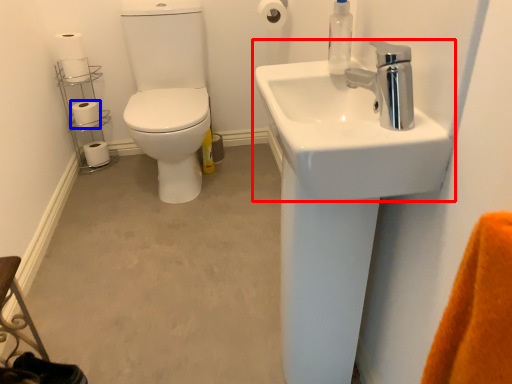
Question: Which object appears farthest to the camera in this image, sink (highlighted by a red box) or toilet paper (highlighted by a blue box)?

Choices:
 (A) sink
 (B) toilet paper

Answer: (B)